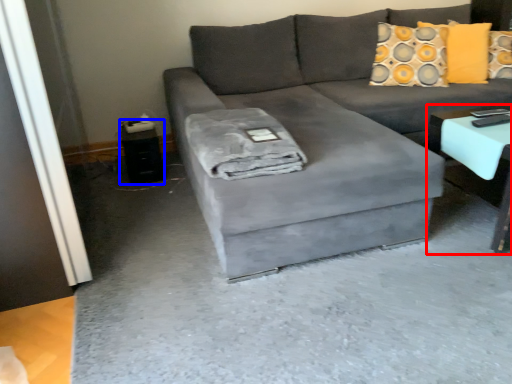
Question: Which of the following is the closest to the observer, table (highlighted by a red box) or side table (highlighted by a blue box)?

Choices:
 (A) table
 (B) side table

Answer: (A)